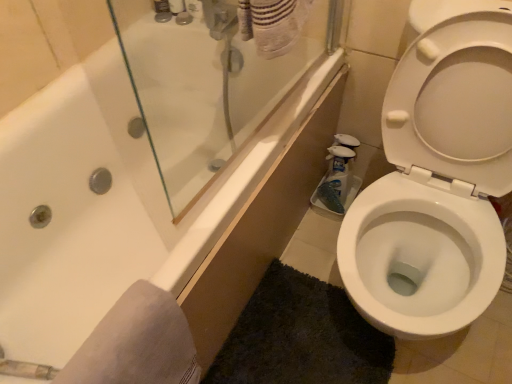
Question: Is dark gray shaggy bath mat at lower right bigger or smaller than white plastic bottle at upper center, which appears as the first toiletry when viewed from the right?

Choices:
 (A) small
 (B) big

Answer: (B)

Question: From a real-world perspective, is dark gray shaggy bath mat at lower right physically located above or below white plastic bottle at upper center, which appears as the first toiletry when viewed from the right?

Choices:
 (A) below
 (B) above

Answer: (A)

Question: Considering the real-world distances, which object is farthest from the gray soft towel at lower left?

Choices:
 (A) white plastic soap dispenser at upper center, the 2th toiletry positioned from the right
 (B) matte plastic soap dispenser at upper center, placed as the third toiletry when sorted from right to left
 (C) white plastic bottle at upper center, which ranks as the third toiletry in left-to-right order
 (D) blue glossy spray bottle at lower right
 (E) white glossy toilet at right

Answer: (A)

Question: Based on their relative distances, which object is nearer to the matte plastic soap dispenser at upper center, the first toiletry from the left?

Choices:
 (A) gray soft towel at lower left
 (B) blue glossy spray bottle at lower right
 (C) white plastic bottle at upper center, which ranks as the third toiletry in left-to-right order
 (D) dark gray shaggy bath mat at lower right
 (E) white plastic soap dispenser at upper center, acting as the second toiletry starting from the left

Answer: (E)